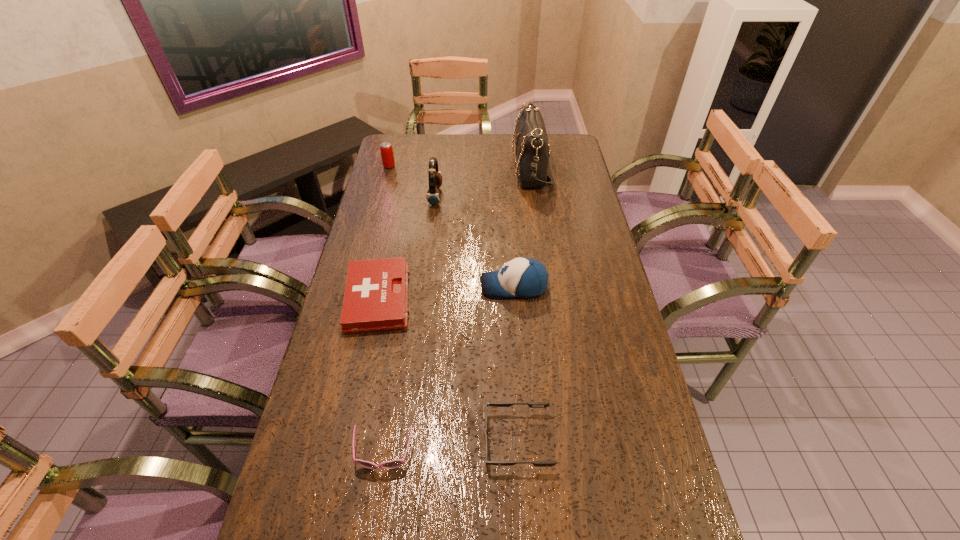
The width and height of the screenshot is (960, 540). Identify the location of vacant space at the right edge of the desktop. (636, 413).

You are a GUI agent. You are given a task and a screenshot of the screen. Output one action in this format:
    pyautogui.click(x=<x>, y=<y>)
    Task: Click on the vacant area at the far left corner
    This screenshot has height=540, width=960.
    Given the screenshot: What is the action you would take?
    pyautogui.click(x=404, y=141)

The width and height of the screenshot is (960, 540). Find the location of `vacant space at the far right corner of the desktop`. vacant space at the far right corner of the desktop is located at coordinates (549, 148).

At what (x,y) coordinates should I click in order to perform the action: click on free space that is in between the headset and the beer can. Please return your answer as a coordinate pair (x, y). Image resolution: width=960 pixels, height=540 pixels. Looking at the image, I should click on (412, 181).

This screenshot has height=540, width=960. Find the location of `vacant space that's between the second tallest object and the baseball cap`. vacant space that's between the second tallest object and the baseball cap is located at coordinates (474, 241).

This screenshot has width=960, height=540. I want to click on unoccupied area between the tallest object and the beer can, so click(x=461, y=167).

Locate an element on the screen. This screenshot has width=960, height=540. vacant point located between the baseball cap and the right sunglasses is located at coordinates (516, 363).

Find the location of a particular element. This screenshot has width=960, height=540. free space that is in between the headset and the right sunglasses is located at coordinates (476, 318).

Identify the location of vacant space in between the first-aid kit and the right sunglasses. This screenshot has height=540, width=960. (447, 369).

You are a GUI agent. You are given a task and a screenshot of the screen. Output one action in this format:
    pyautogui.click(x=<x>, y=<y>)
    Task: Click on the blank region between the right sunglasses and the beer can
    This screenshot has width=960, height=540.
    Given the screenshot: What is the action you would take?
    pyautogui.click(x=453, y=303)